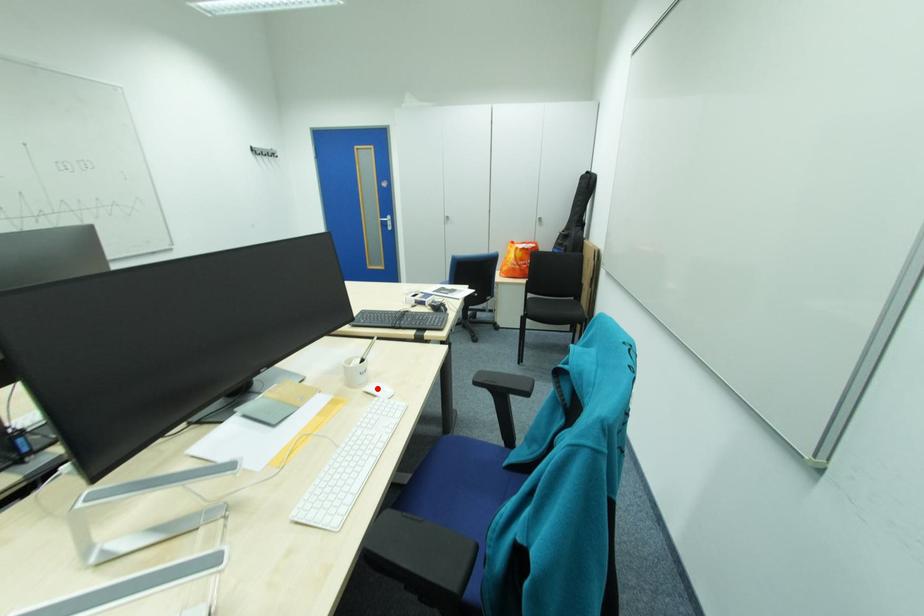
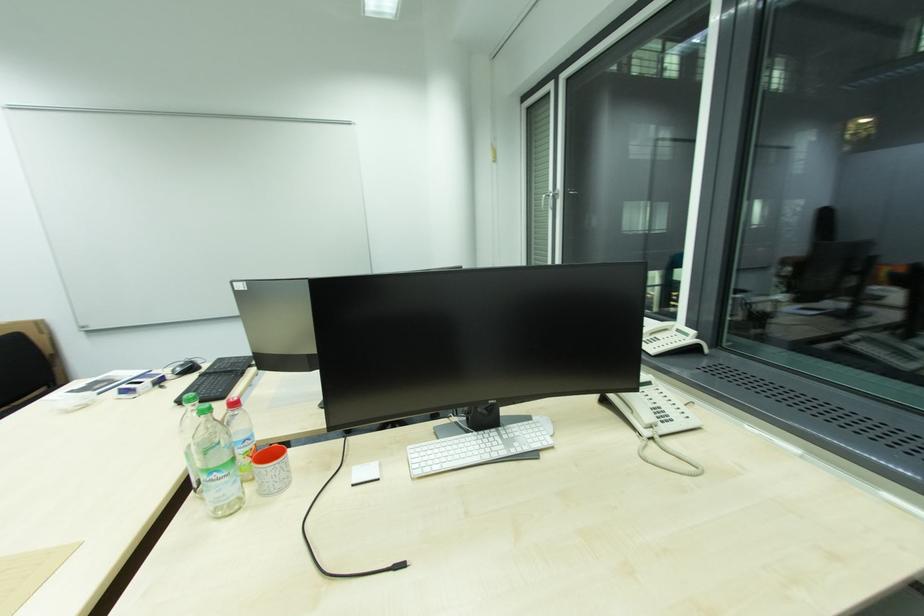
Question: I am providing you with two images of the same scene from different viewpoints. A red point is marked on the first image. At the location where the point appears in image 1, is it still visible in image 2?

Choices:
 (A) Yes
 (B) No

Answer: (B)